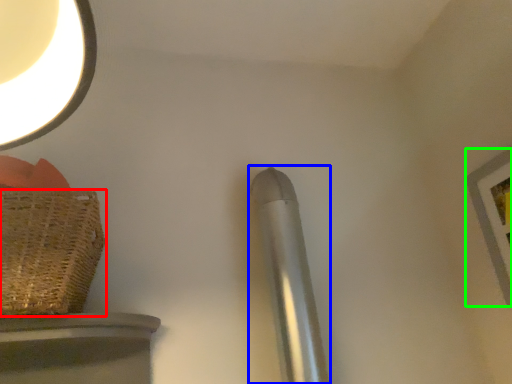
Question: Which object is positioned farthest from basket (highlighted by a red box)? Select from steel (highlighted by a blue box) and picture frame (highlighted by a green box).

Choices:
 (A) steel
 (B) picture frame

Answer: (B)